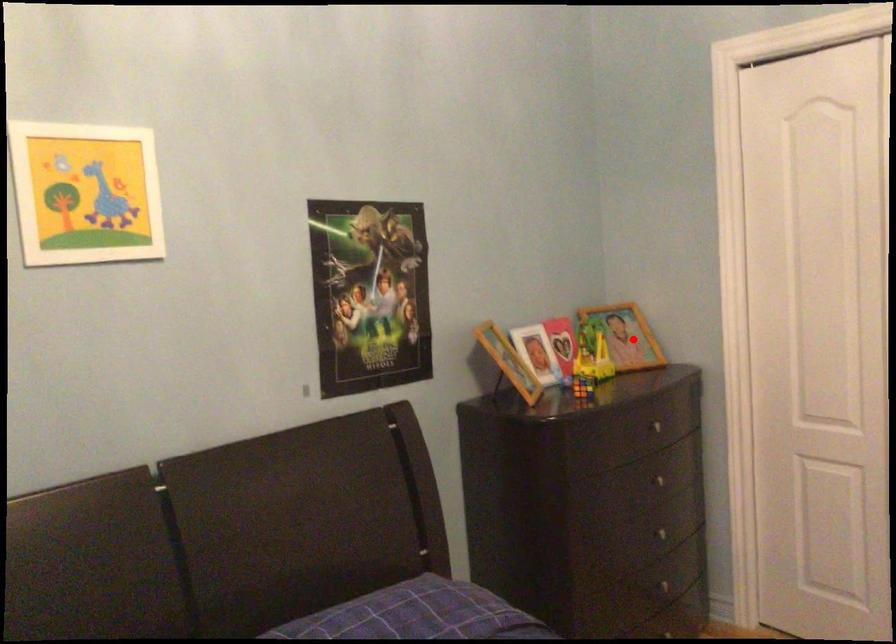
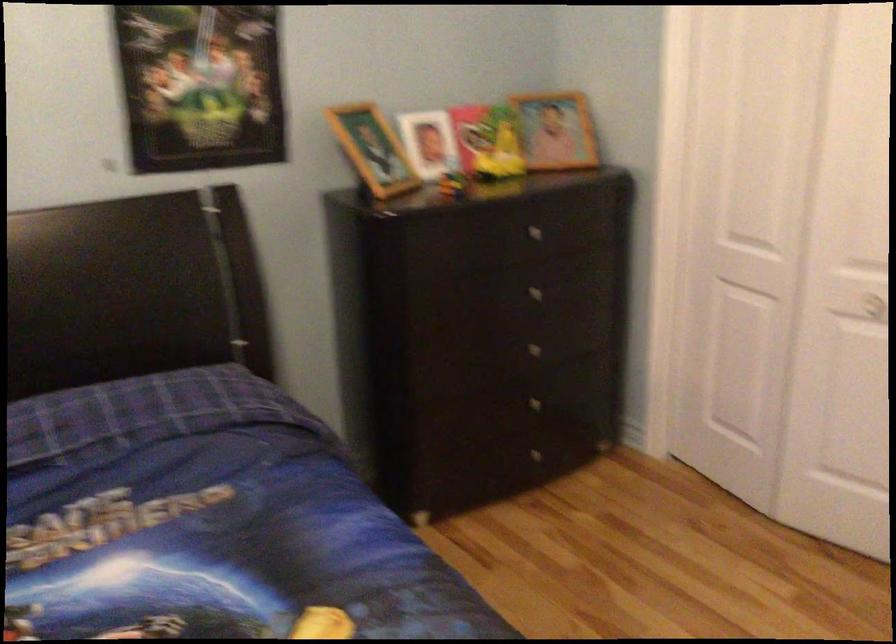
Where in the second image is the point corresponding to the highlighted location from the first image?

(556, 129)